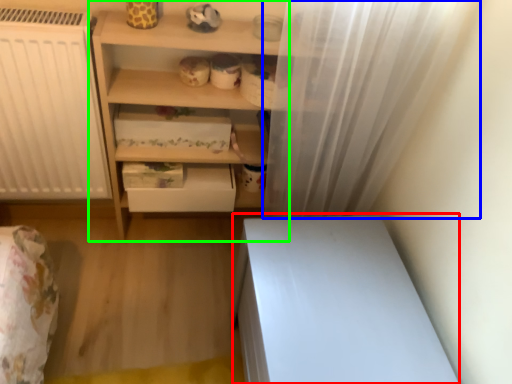
Question: Which object is positioned closest to vanity (highlighted by a red box)? Select from shower curtain (highlighted by a blue box) and shelf (highlighted by a green box).

Choices:
 (A) shower curtain
 (B) shelf

Answer: (A)